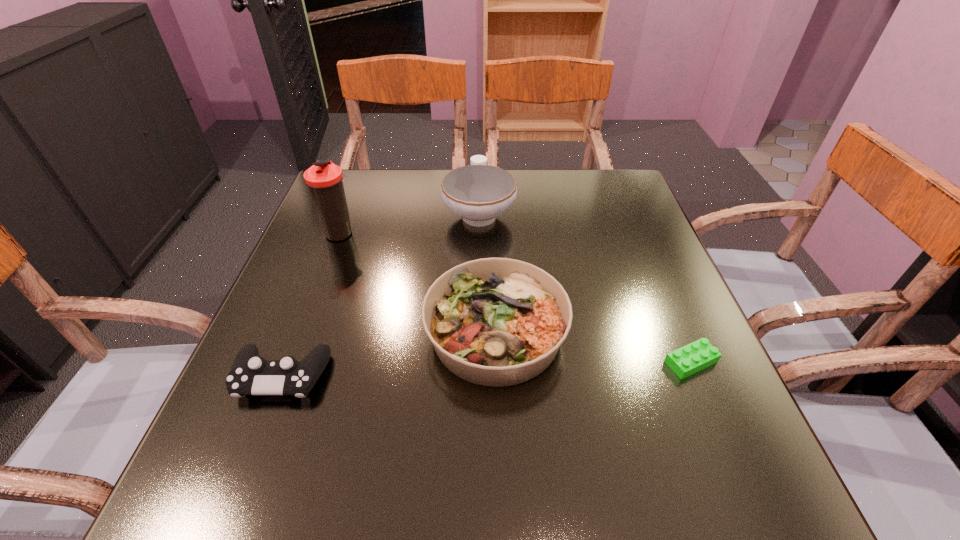
At what (x,y) coordinates should I click in order to perform the action: click on vacant space at the near right corner of the desktop. Please return your answer as a coordinate pair (x, y). The height and width of the screenshot is (540, 960). Looking at the image, I should click on (707, 463).

Locate an element on the screen. vacant space in between the rightmost object and the salad plate is located at coordinates (593, 347).

Where is `empty space between the fourth shortest object and the tallest object`? Image resolution: width=960 pixels, height=540 pixels. empty space between the fourth shortest object and the tallest object is located at coordinates (410, 222).

At what (x,y) coordinates should I click in order to perform the action: click on vacant space that's between the second tallest object and the rightmost object. Please return your answer as a coordinate pair (x, y). The width and height of the screenshot is (960, 540). Looking at the image, I should click on (585, 287).

I want to click on free space between the salad plate and the thermos bottle, so coord(419,283).

Identify the location of vacant space that is in between the third shortest object and the shortest object. (593, 347).

Locate an element on the screen. The image size is (960, 540). vacant area that lies between the Lego and the fourth shortest object is located at coordinates (585, 287).

Identify which object is the closest to the shortest object. Please provide its 2D coordinates. Your answer should be formatted as a tuple, i.e. [(x, y)], where the tuple contains the x and y coordinates of a point satisfying the conditions above.

[(497, 322)]

The height and width of the screenshot is (540, 960). Identify the location of object that can be found as the second closest to the tallest object. (497, 322).

Where is `free space that satisfies the following two spatial constraints: 1. on the front side of the rightmost object; 2. on the right side of the third shortest object`? The image size is (960, 540). free space that satisfies the following two spatial constraints: 1. on the front side of the rightmost object; 2. on the right side of the third shortest object is located at coordinates (496, 362).